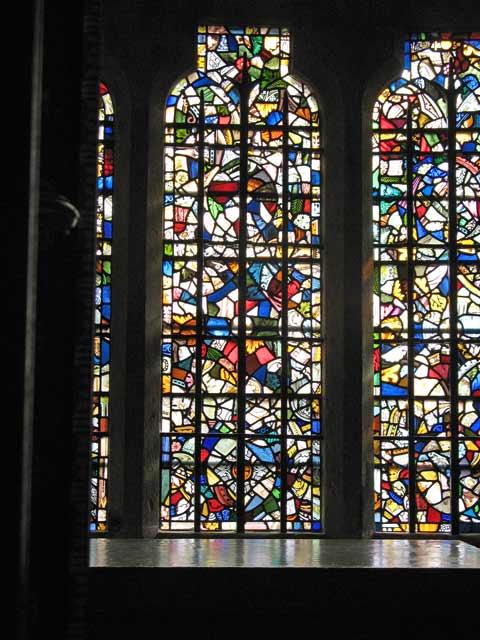
Identify the location of reflection of church windows on shelf. (227, 552).